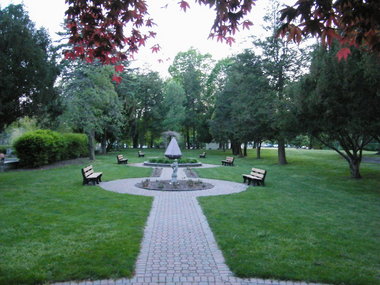
Find the location of `wood slats`. wood slats is located at coordinates (89, 170), (92, 174), (249, 177), (257, 172), (118, 154), (144, 150), (200, 153), (263, 171).